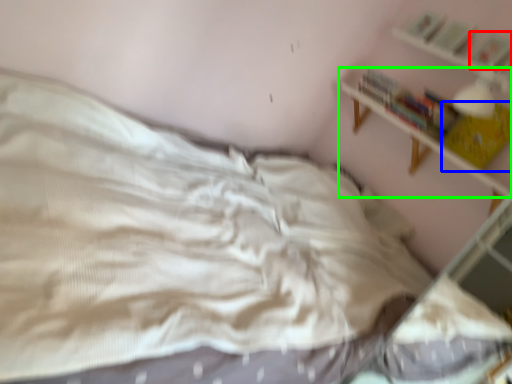
Question: Which object is the closest to the book (highlighted by a red box)? Choose among these: book (highlighted by a blue box) or shelf (highlighted by a green box).

Choices:
 (A) book
 (B) shelf

Answer: (A)